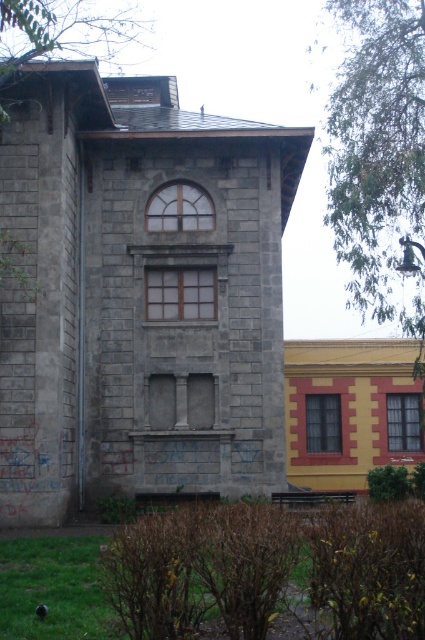
Does gray stone tower at center have a greater height compared to brown wooden window at center?

Yes, gray stone tower at center is taller than brown wooden window at center.

Between gray stone tower at center and brown wooden window at center, which one has less height?

brown wooden window at center

At what (x,y) coordinates should I click in order to perform the action: click on gray stone tower at center. Please return your answer as a coordinate pair (x, y). Looking at the image, I should click on (135, 294).

Identify the location of gray stone tower at center. This screenshot has width=425, height=640. (135, 294).

Is point (167, 316) less distant than point (147, 224)?

Yes, point (167, 316) is in front of point (147, 224).

Can you confirm if brown wooden window at center is wider than matte glass window at upper center?

Yes.

Is point (203, 305) in front of point (170, 204)?

Yes, point (203, 305) is closer to viewer.

The height and width of the screenshot is (640, 425). I want to click on brown wooden window at center, so click(180, 292).

Is gray stone tower at center below clear glass window at center?

No.

Which is below, gray stone tower at center or clear glass window at center?

Positioned lower is clear glass window at center.

Is point (81, 476) positioned before point (408, 451)?

Yes, point (81, 476) is in front of point (408, 451).

Find the location of a particular element. This screenshot has width=425, height=640. gray stone tower at center is located at coordinates (135, 294).